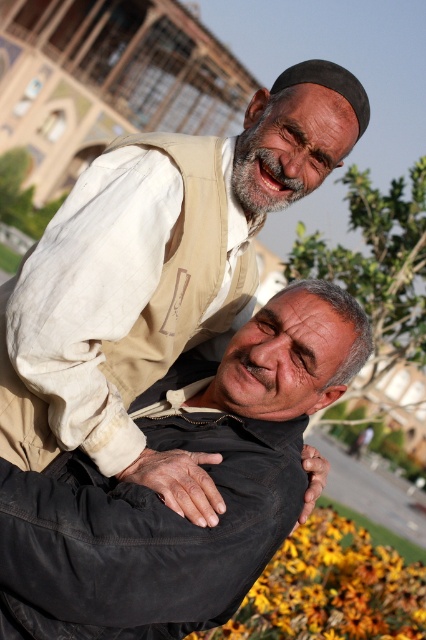
Between beige fabric sleeve at upper left and yellow matte flower at lower center, which one has less height?

beige fabric sleeve at upper left

Is point (89, 365) positioned before point (317, 604)?

Yes, it is.

The height and width of the screenshot is (640, 426). I want to click on beige fabric sleeve at upper left, so click(103, 320).